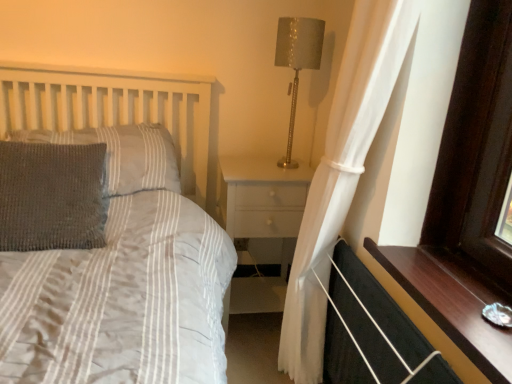
Question: Is woolen gray pillow at left, positioned as the first pillow in back-to-front order, thinner than white sheer curtain at right?

Choices:
 (A) no
 (B) yes

Answer: (A)

Question: From the image's perspective, is woolen gray pillow at left, positioned as the first pillow in back-to-front order, above white sheer curtain at right?

Choices:
 (A) yes
 (B) no

Answer: (A)

Question: Is woolen gray pillow at left, acting as the 2th pillow starting from the front, at the right side of white sheer curtain at right?

Choices:
 (A) yes
 (B) no

Answer: (B)

Question: Is woolen gray pillow at left, acting as the 2th pillow starting from the front, behind white sheer curtain at right?

Choices:
 (A) no
 (B) yes

Answer: (B)

Question: Considering the relative positions of dark wood window sill at lower right and metallic gold table lamp at upper right in the image provided, is dark wood window sill at lower right to the left or to the right of metallic gold table lamp at upper right?

Choices:
 (A) left
 (B) right

Answer: (B)

Question: Choose the correct answer: Is dark wood window sill at lower right inside metallic gold table lamp at upper right or outside it?

Choices:
 (A) outside
 (B) inside

Answer: (A)

Question: Is point (462, 326) positioned closer to the camera than point (309, 24)?

Choices:
 (A) farther
 (B) closer

Answer: (B)

Question: From the image's perspective, is dark wood window sill at lower right positioned above or below metallic gold table lamp at upper right?

Choices:
 (A) above
 (B) below

Answer: (B)

Question: Considering the positions of metallic gold table lamp at upper right and black fabric balustrade at lower right in the image, is metallic gold table lamp at upper right taller or shorter than black fabric balustrade at lower right?

Choices:
 (A) tall
 (B) short

Answer: (A)

Question: Considering the relative positions of metallic gold table lamp at upper right and black fabric balustrade at lower right in the image provided, is metallic gold table lamp at upper right to the left or to the right of black fabric balustrade at lower right?

Choices:
 (A) left
 (B) right

Answer: (A)

Question: Considering the positions of point 292,102 and point 410,357, is point 292,102 closer or farther from the camera than point 410,357?

Choices:
 (A) farther
 (B) closer

Answer: (A)

Question: Considering the positions of metallic gold table lamp at upper right and black fabric balustrade at lower right in the image, is metallic gold table lamp at upper right bigger or smaller than black fabric balustrade at lower right?

Choices:
 (A) big
 (B) small

Answer: (A)

Question: Based on their sizes in the image, would you say woolen gray pillow at left, positioned as the first pillow in back-to-front order, is bigger or smaller than gray knitted pillow at left, marked as the 2th pillow in a back-to-front arrangement?

Choices:
 (A) big
 (B) small

Answer: (A)

Question: From the image's perspective, is woolen gray pillow at left, positioned as the first pillow in back-to-front order, positioned above or below gray knitted pillow at left, acting as the first pillow starting from the front?

Choices:
 (A) below
 (B) above

Answer: (B)